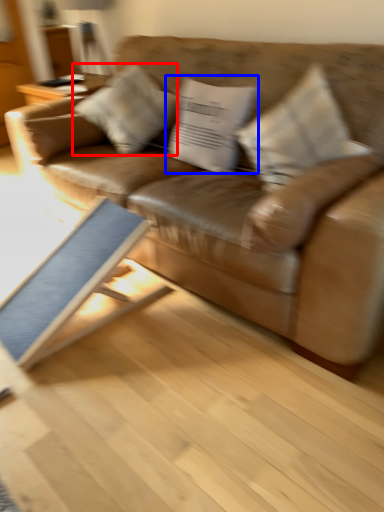
Question: Among these objects, which one is nearest to the camera, pillow (highlighted by a red box) or pillow (highlighted by a blue box)?

Choices:
 (A) pillow
 (B) pillow

Answer: (B)